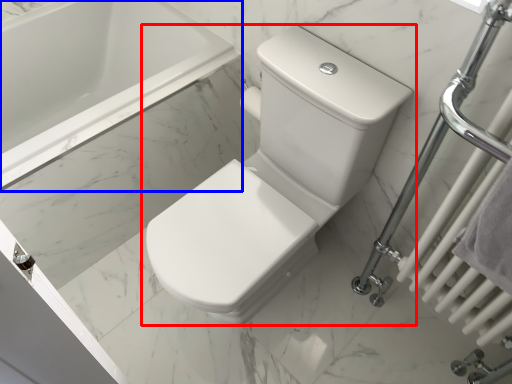
Question: Which object appears farthest to the camera in this image, toilet (highlighted by a red box) or bathtub (highlighted by a blue box)?

Choices:
 (A) toilet
 (B) bathtub

Answer: (B)